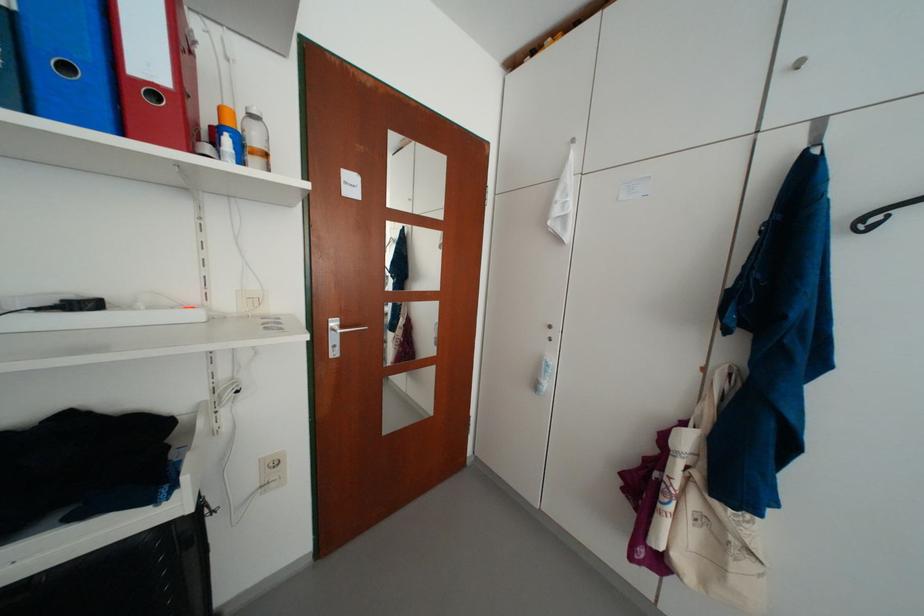
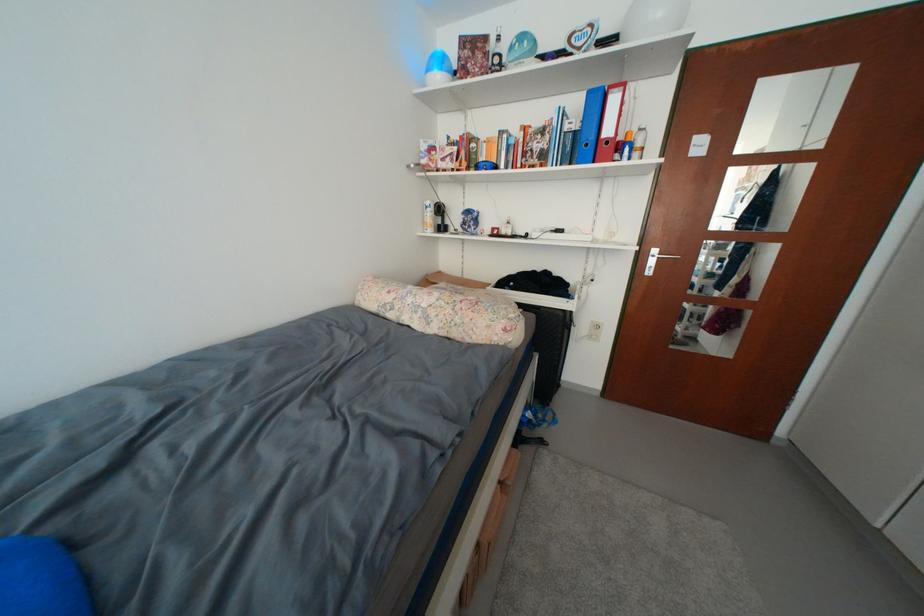
In the second image, find the point that corresponds to [214,150] in the first image.

(626, 159)